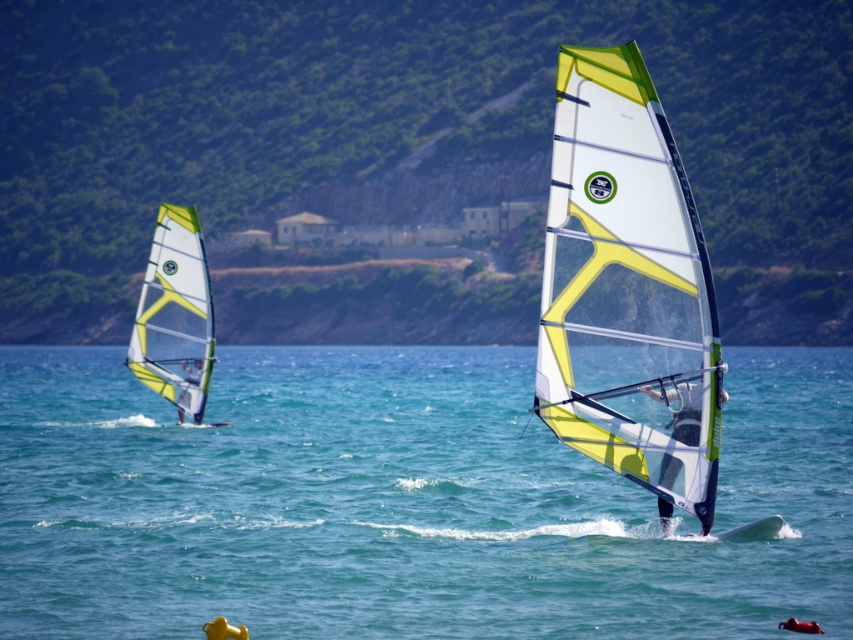
You are a photographer trying to capture the green leafy hillside at upper center and the transparent water at center in a single shot. Based on their positions, which object would appear closer to the camera?

The green leafy hillside at upper center appears closer to the camera because it is in front of the transparent water at center.

You are a drone operator trying to capture a photo of the two windsurfers in the scene. The camera is currently positioned at point [401,156]. Based on the scene description, what is the most likely obstruction you might encounter when taking this photo?

The point [401,156] is on a green leafy hillside at upper center, which could obstruct the drone camera from capturing a clear view of the windsurfers in the foreground and background.

You are a drone operator trying to capture a photo of the transparent water at center. The drone is currently at a position above the scene. What are the 2D coordinates where you should direct the drone to focus for the best shot?

The 2D coordinates for the transparent water at center are at point (402, 500). Direct the drone to focus there for the best shot.